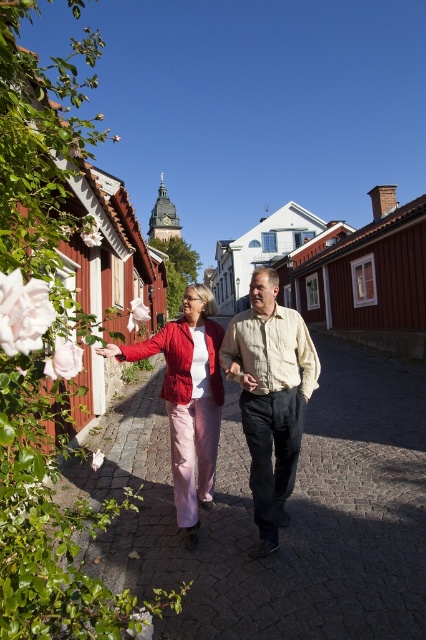
Can you confirm if pink fabric at center is taller than light beige cotton shirt at center?

Incorrect, pink fabric at center's height is not larger of light beige cotton shirt at center's.

Which of these two, pink fabric at center or light beige cotton shirt at center, stands taller?

With more height is light beige cotton shirt at center.

You are a GUI agent. You are given a task and a screenshot of the screen. Output one action in this format:
    pyautogui.click(x=<x>, y=<y>)
    Task: Click on the pink fabric at center
    Image resolution: width=426 pixels, height=640 pixels.
    Given the screenshot: What is the action you would take?
    pyautogui.click(x=287, y=508)

The width and height of the screenshot is (426, 640). Find the location of `pink fabric at center`. pink fabric at center is located at coordinates (287, 508).

Does light beige cotton shirt at center lie behind matte red jacket at center?

Yes.

Who is taller, light beige cotton shirt at center or matte red jacket at center?

light beige cotton shirt at center

Between point (270, 337) and point (206, 392), which one is positioned behind?

The point (206, 392) is behind.

This screenshot has width=426, height=640. In order to click on light beige cotton shirt at center in this screenshot , I will do `click(270, 396)`.

Does pink fabric at center appear over matte red jacket at center?

No.

Who is more distant from viewer, (143,426) or (178,458)?

The point (143,426) is more distant.

At what (x,y) coordinates should I click in order to perform the action: click on pink fabric at center. Please return your answer as a coordinate pair (x, y). The height and width of the screenshot is (640, 426). Looking at the image, I should click on (287, 508).